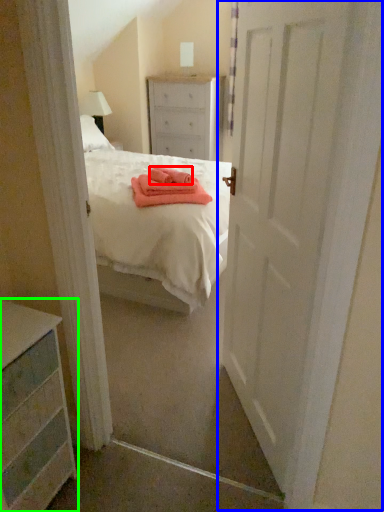
Question: Which object is positioned farthest from cloth (highlighted by a red box)? Select from door (highlighted by a blue box) and chest of drawers (highlighted by a green box).

Choices:
 (A) door
 (B) chest of drawers

Answer: (B)